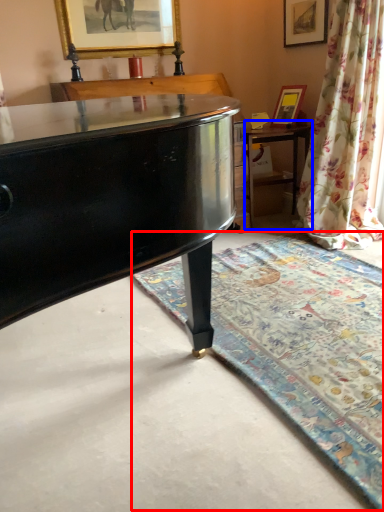
Question: Which point is closer to the camera, mat (highlighted by a red box) or table (highlighted by a blue box)?

Choices:
 (A) mat
 (B) table

Answer: (A)